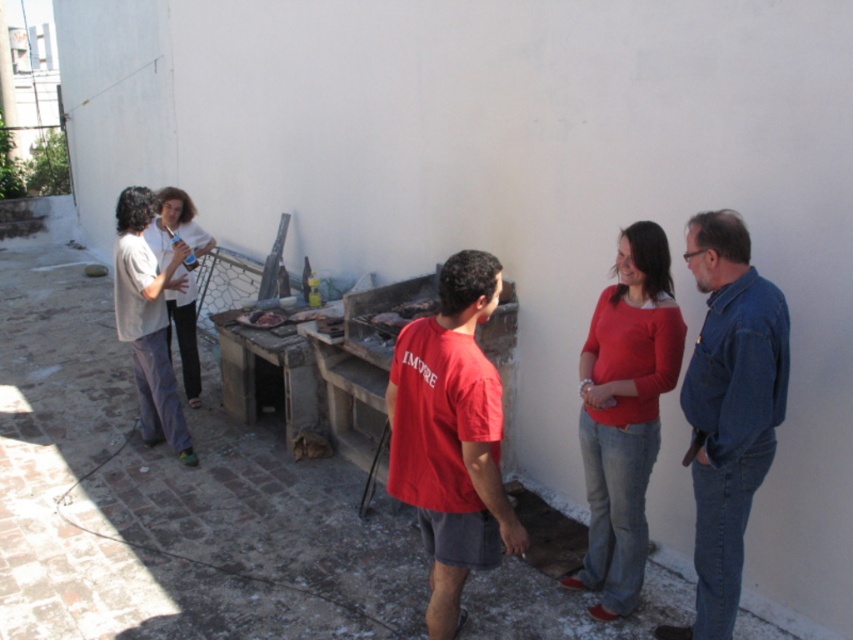
Is blue denim shirt at right smaller than white matte shirt at left?

Indeed, blue denim shirt at right has a smaller size compared to white matte shirt at left.

Between point (712, 518) and point (189, 276), which one is positioned behind?

Point (189, 276)

Describe the element at coordinates (728, 410) in the screenshot. The width and height of the screenshot is (853, 640). I see `blue denim shirt at right` at that location.

What are the coordinates of `blue denim shirt at right` in the screenshot? It's located at (728, 410).

Which is above, red matte shirt at center or brown leather food at center?

brown leather food at center is above.

Which is in front, point (442, 372) or point (271, 314)?

Point (442, 372) is more forward.

Is point (473, 520) more distant than point (271, 323)?

That is False.

The image size is (853, 640). Find the location of `red matte shirt at center`. red matte shirt at center is located at coordinates (451, 436).

Which is above, matte red sweater at center or white matte shirt at left?

white matte shirt at left is above.

Locate an element on the screen. matte red sweater at center is located at coordinates (624, 413).